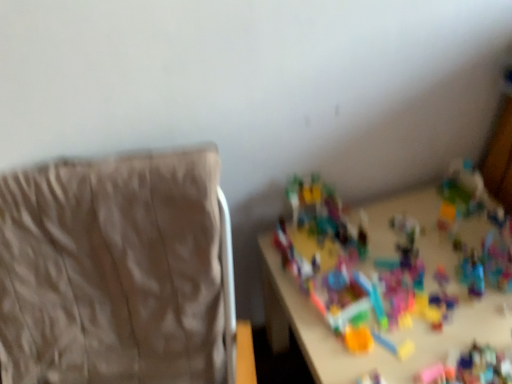
Question: Does multicolored plastic toys at center have a greater height compared to beige fabric chair at left?

Choices:
 (A) yes
 (B) no

Answer: (B)

Question: From a real-world perspective, is multicolored plastic toys at center on top of beige fabric chair at left?

Choices:
 (A) no
 (B) yes

Answer: (A)

Question: Is multicolored plastic toys at center in front of beige fabric chair at left?

Choices:
 (A) yes
 (B) no

Answer: (B)

Question: Is multicolored plastic toys at center looking in the opposite direction of beige fabric chair at left?

Choices:
 (A) no
 (B) yes

Answer: (A)

Question: Could you tell me if multicolored plastic toys at center is turned towards beige fabric chair at left?

Choices:
 (A) yes
 (B) no

Answer: (B)

Question: Considering the relative sizes of multicolored plastic toys at center and beige fabric chair at left in the image provided, is multicolored plastic toys at center thinner than beige fabric chair at left?

Choices:
 (A) no
 (B) yes

Answer: (B)

Question: Could you tell me if beige fabric chair at left is turned towards multicolored plastic toys at center?

Choices:
 (A) no
 (B) yes

Answer: (A)

Question: Is beige fabric chair at left positioned far away from multicolored plastic toys at center?

Choices:
 (A) no
 (B) yes

Answer: (A)

Question: Does beige fabric chair at left have a smaller size compared to multicolored plastic toys at center?

Choices:
 (A) yes
 (B) no

Answer: (B)

Question: Is beige fabric chair at left directly adjacent to multicolored plastic toys at center?

Choices:
 (A) yes
 (B) no

Answer: (B)

Question: Considering the relative positions of beige fabric chair at left and multicolored plastic toys at center in the image provided, is beige fabric chair at left to the left of multicolored plastic toys at center from the viewer's perspective?

Choices:
 (A) yes
 (B) no

Answer: (A)

Question: From the image's perspective, would you say beige fabric chair at left is positioned over multicolored plastic toys at center?

Choices:
 (A) yes
 (B) no

Answer: (B)

Question: Would you say beige fabric chair at left is inside or outside multicolored plastic toys at center?

Choices:
 (A) inside
 (B) outside

Answer: (B)